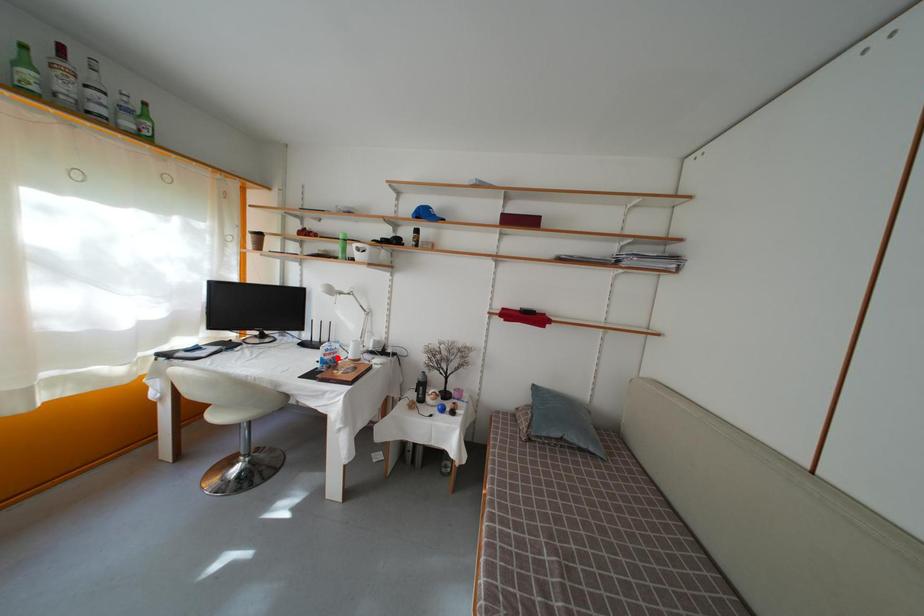
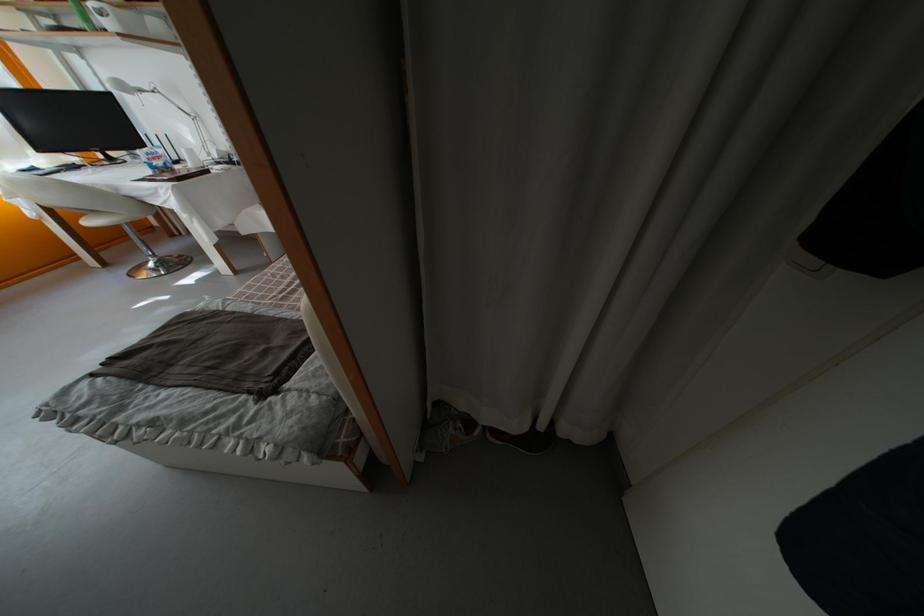
In the second image, find the point that corresponds to the highlighted location in the first image.

(160, 161)